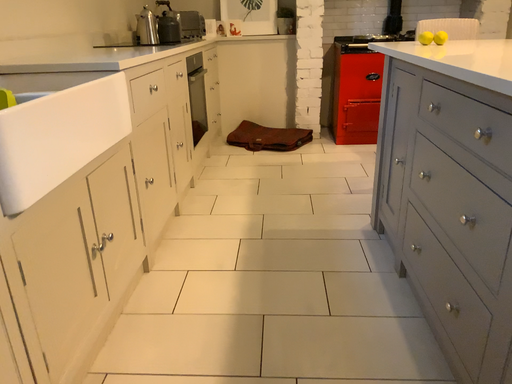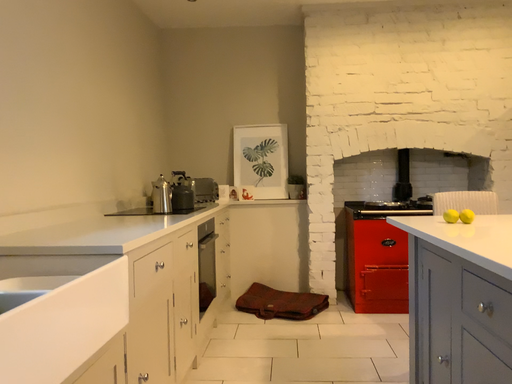
Question: Which way did the camera rotate in the video?

Choices:
 (A) rotated upward
 (B) rotated downward

Answer: (A)